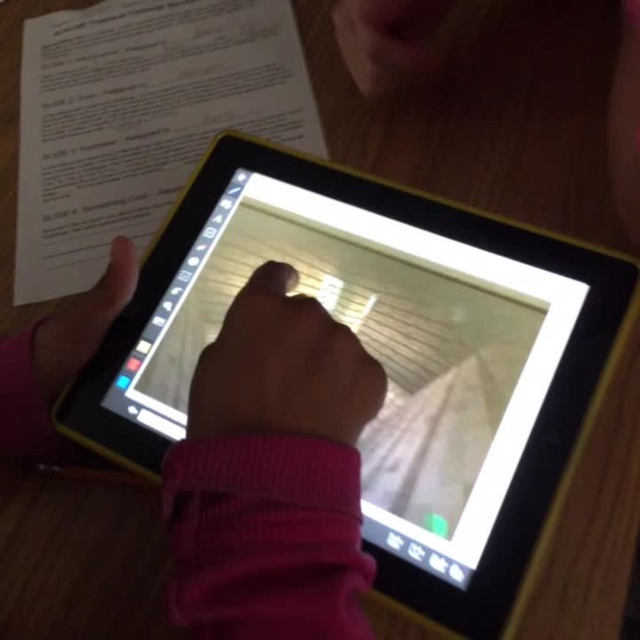
Can you confirm if smooth skin hand at center is thinner than matte black hand at lower left?

Yes.

Measure the distance between smooth skin hand at center and camera.

smooth skin hand at center is 12.63 inches away from camera.

Locate an element on the screen. This screenshot has width=640, height=640. smooth skin hand at center is located at coordinates (282, 369).

Locate an element on the screen. smooth skin hand at center is located at coordinates (282, 369).

Who is higher up, pink fabric sleeve at center or matte black hand at lower left?

matte black hand at lower left is higher up.

Is point (352, 394) less distant than point (42, 378)?

Yes, it is in front of point (42, 378).

Find the location of a particular element. This screenshot has height=640, width=640. pink fabric sleeve at center is located at coordinates (273, 474).

Does point (544, 502) come in front of point (92, 304)?

That is True.

Who is lower down, black plastic tablet at center or matte black hand at lower left?

black plastic tablet at center

Is point (586, 387) closer to camera compared to point (84, 307)?

Yes, it is in front of point (84, 307).

Image resolution: width=640 pixels, height=640 pixels. What are the coordinates of `black plastic tablet at center` in the screenshot? It's located at (385, 358).